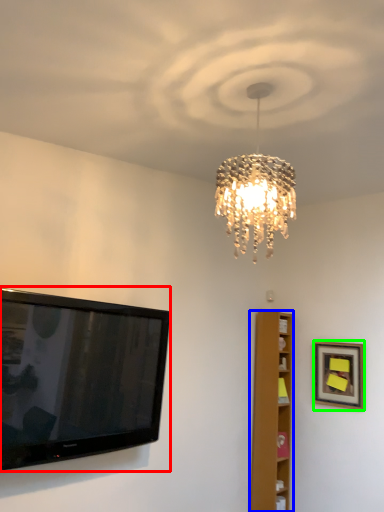
Question: Which object is positioned closest to television (highlighted by a red box)? Select from furniture (highlighted by a blue box) and picture frame (highlighted by a green box).

Choices:
 (A) furniture
 (B) picture frame

Answer: (A)